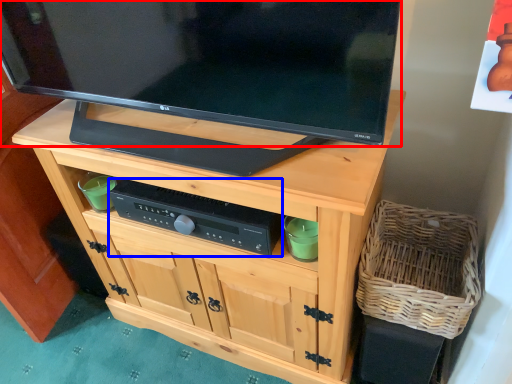
Question: Among these objects, which one is farthest to the camera, television (highlighted by a red box) or control (highlighted by a blue box)?

Choices:
 (A) television
 (B) control

Answer: (B)